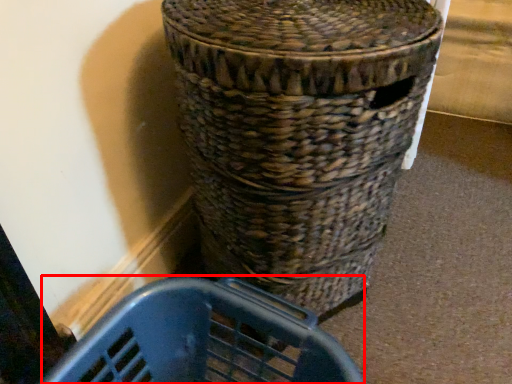
Question: From the image's perspective, what is the correct spatial positioning of basket container (annotated by the red box) in reference to waste container?

Choices:
 (A) above
 (B) below

Answer: (B)